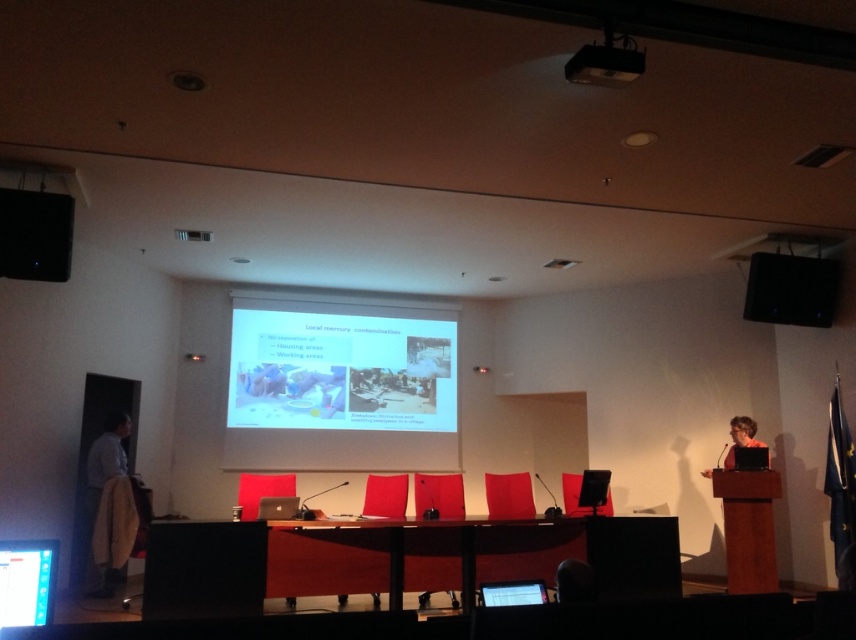
You are sitting in the conference room and looking at the slide about local mercury contamination. There are two points marked on the slide at coordinates point (592, 84) and point (732, 449). Which point is closer to you?

Point (592, 84) is closer to the viewer than point (732, 449).

You are an attendee at the conference and need to present next. You see the black plastic projector at upper center and the matte black laptop at right. Which device should you adjust if you want to move closer to the screen?

You should adjust the matte black laptop at right because it is located to the right of the black plastic projector at upper center, so moving it closer to the screen would require repositioning the laptop.

Based on the photo, you are attending a presentation in the conference room and notice two speakers. The black matte speaker at upper left and the black plastic speaker at upper right. Which speaker is positioned higher in the room?

The black matte speaker at upper left is positioned higher in the room than the black plastic speaker at upper right because it is located above it.